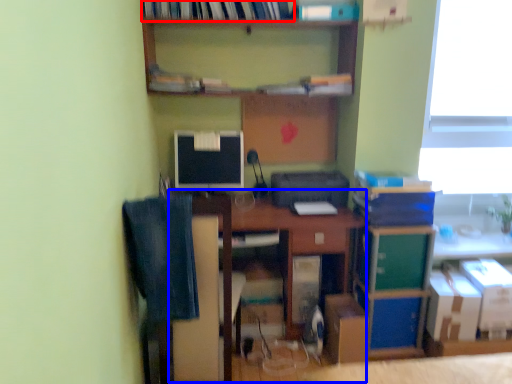
Question: Which object is further to the camera taking this photo, book (highlighted by a red box) or computer desk (highlighted by a blue box)?

Choices:
 (A) book
 (B) computer desk

Answer: (B)